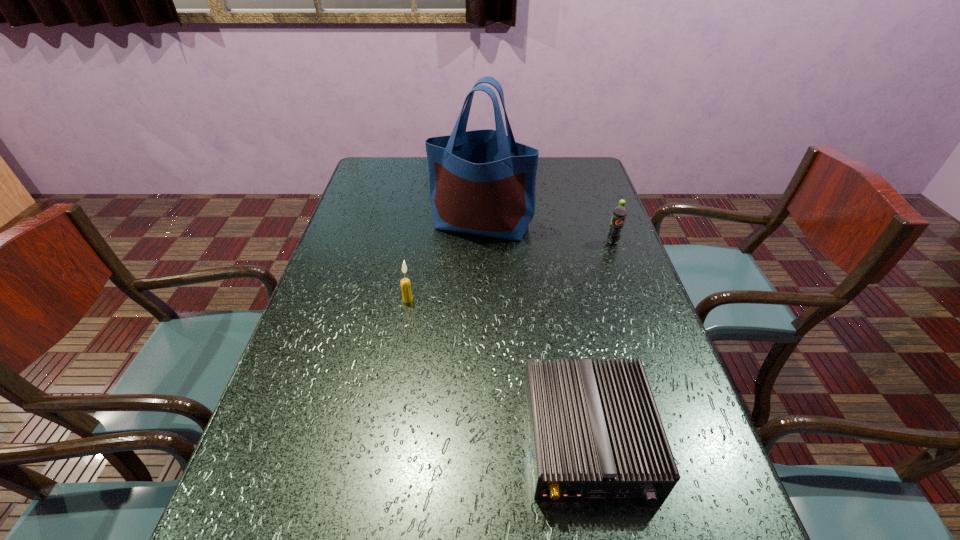
Find the location of a particular element. This screenshot has height=540, width=960. handbag is located at coordinates (482, 182).

You are a GUI agent. You are given a task and a screenshot of the screen. Output one action in this format:
    pyautogui.click(x=<x>, y=<y>)
    Task: Click on the soda
    Image resolution: width=960 pixels, height=540 pixels.
    Given the screenshot: What is the action you would take?
    pyautogui.click(x=619, y=213)

The height and width of the screenshot is (540, 960). Identify the location of the third farthest object. (407, 297).

I want to click on candle, so click(x=407, y=297).

Find the location of a particular element. This screenshot has width=960, height=540. the shortest object is located at coordinates pyautogui.click(x=595, y=432).

The width and height of the screenshot is (960, 540). Find the location of `the nearest object`. the nearest object is located at coordinates (595, 432).

What are the coordinates of `free region located on the front of the tallest object` in the screenshot? It's located at (482, 319).

Locate an element on the screen. free space located 0.250m on the front label of the soda is located at coordinates (636, 308).

Identify the location of free space located 0.230m on the left of the candle. The width and height of the screenshot is (960, 540). (312, 300).

Find the location of a particular element. This screenshot has height=540, width=960. soda positioned at the right edge is located at coordinates (619, 213).